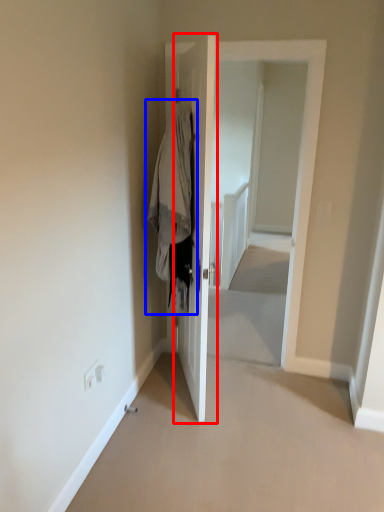
Question: Which object appears closest to the camera in this image, door (highlighted by a red box) or clothing (highlighted by a blue box)?

Choices:
 (A) door
 (B) clothing

Answer: (A)